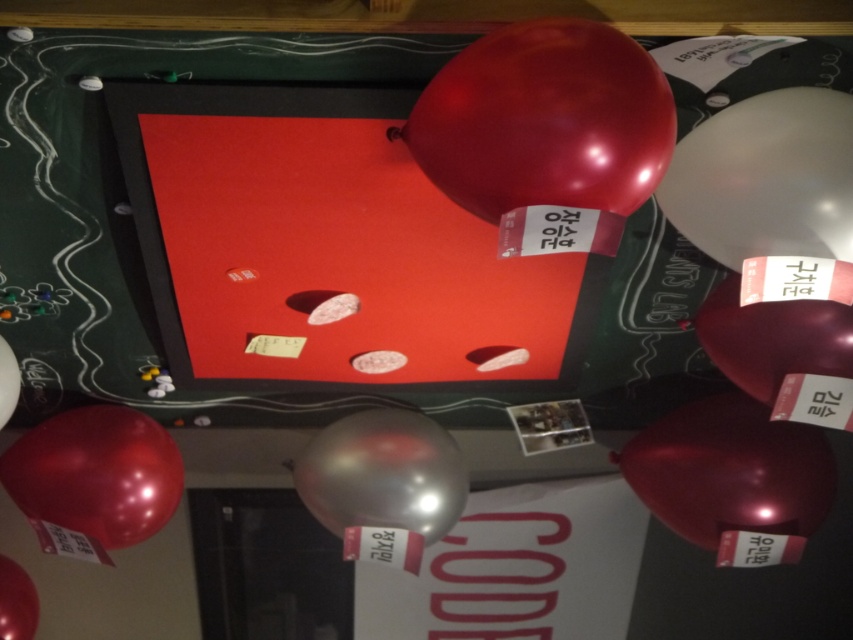
Does glossy metallic balloon at lower left appear under shiny metallic balloon at left?

Correct, glossy metallic balloon at lower left is located below shiny metallic balloon at left.

Who is more forward, (32, 508) or (12, 406)?

Point (12, 406) is in front.

Find the location of a particular element. This screenshot has height=640, width=853. glossy metallic balloon at lower left is located at coordinates (96, 474).

Between glossy red balloon at upper center and transparent metallic balloon at upper right, which one has less height?

glossy red balloon at upper center

Can you confirm if glossy red balloon at upper center is positioned above transparent metallic balloon at upper right?

Indeed, glossy red balloon at upper center is positioned over transparent metallic balloon at upper right.

Where is `glossy red balloon at upper center`? The image size is (853, 640). glossy red balloon at upper center is located at coordinates click(x=544, y=120).

Based on the photo, between glossy red balloon at upper center and metallic silver balloon at center, which one is positioned lower?

Positioned lower is metallic silver balloon at center.

Is point (492, 40) farther from viewer compared to point (401, 458)?

No, it is in front of (401, 458).

What are the coordinates of `glossy red balloon at upper center` in the screenshot? It's located at (544, 120).